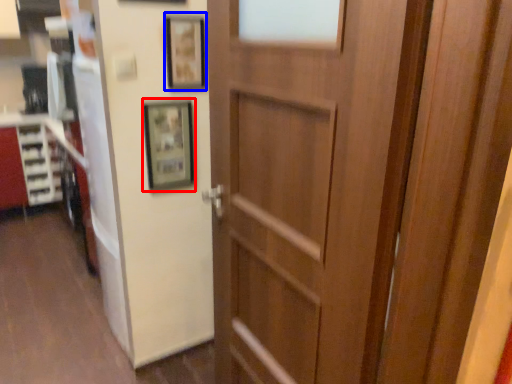
Question: Which object appears farthest to the camera in this image, picture frame (highlighted by a red box) or picture frame (highlighted by a blue box)?

Choices:
 (A) picture frame
 (B) picture frame

Answer: (A)